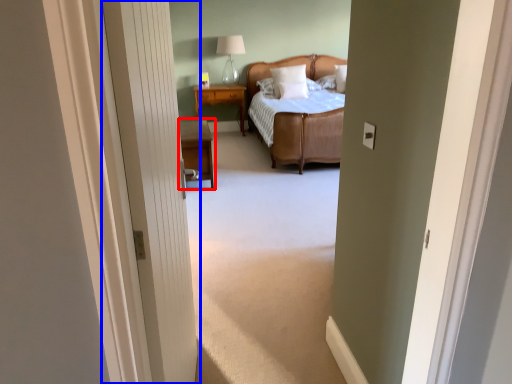
Question: Which of the following is the farthest to the observer, nightstand (highlighted by a red box) or door (highlighted by a blue box)?

Choices:
 (A) nightstand
 (B) door

Answer: (A)